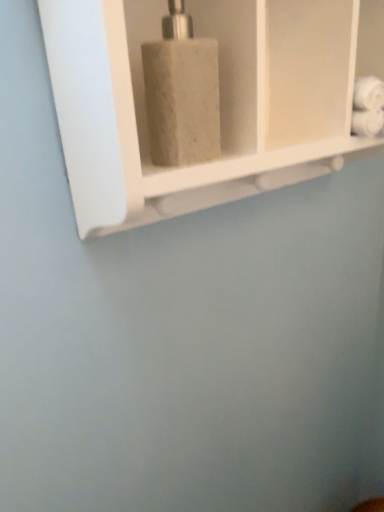
Where is `white marble soap dispenser at center`? Image resolution: width=384 pixels, height=512 pixels. white marble soap dispenser at center is located at coordinates (220, 102).

This screenshot has width=384, height=512. Describe the element at coordinates (220, 102) in the screenshot. I see `white marble soap dispenser at center` at that location.

From the picture: Measure the distance between white marble soap dispenser at center and camera.

The depth of white marble soap dispenser at center is 33.11 centimeters.

You are a GUI agent. You are given a task and a screenshot of the screen. Output one action in this format:
    pyautogui.click(x=<x>, y=<y>)
    Task: Click on the matte gray soap dispenser at center
    The width and height of the screenshot is (384, 512).
    Given the screenshot: What is the action you would take?
    pyautogui.click(x=182, y=93)

This screenshot has height=512, width=384. Describe the element at coordinates (182, 93) in the screenshot. I see `matte gray soap dispenser at center` at that location.

Where is `white marble soap dispenser at center`? The image size is (384, 512). white marble soap dispenser at center is located at coordinates (220, 102).

Consider the image. Which object is positioned more to the right, white marble soap dispenser at center or matte gray soap dispenser at center?

white marble soap dispenser at center.

Looking at this image, does white marble soap dispenser at center come in front of matte gray soap dispenser at center?

That is True.

Which point is more distant from viewer, [311,56] or [201,106]?

The point [311,56] is farther from the camera.

From the image's perspective, relative to matte gray soap dispenser at center, is white marble soap dispenser at center above or below?

white marble soap dispenser at center is situated higher than matte gray soap dispenser at center in the image.

From a real-world perspective, is white marble soap dispenser at center on matte gray soap dispenser at center?

No, from a real-world perspective, white marble soap dispenser at center is not on top of matte gray soap dispenser at center.

Looking at their sizes, would you say white marble soap dispenser at center is wider or thinner than matte gray soap dispenser at center?

white marble soap dispenser at center is wider than matte gray soap dispenser at center.

Who is shorter, white marble soap dispenser at center or matte gray soap dispenser at center?

matte gray soap dispenser at center is shorter.

Which of these two, white marble soap dispenser at center or matte gray soap dispenser at center, is smaller?

matte gray soap dispenser at center is smaller.

Is matte gray soap dispenser at center located within white marble soap dispenser at center?

Indeed, matte gray soap dispenser at center is located within white marble soap dispenser at center.

Is white marble soap dispenser at center directly adjacent to matte gray soap dispenser at center?

No, white marble soap dispenser at center is not with matte gray soap dispenser at center.

Could you tell me if white marble soap dispenser at center is facing matte gray soap dispenser at center?

Yes, white marble soap dispenser at center is aimed at matte gray soap dispenser at center.

How different are the orientations of white marble soap dispenser at center and matte gray soap dispenser at center in degrees?

white marble soap dispenser at center and matte gray soap dispenser at center are facing 0.273 degrees away from each other.

Locate an element on the screen. Image resolution: width=384 pixels, height=512 pixels. soap dispenser lying below the white marble soap dispenser at center (from the image's perspective) is located at coordinates tap(182, 93).

Which is more to the right, matte gray soap dispenser at center or white marble soap dispenser at center?

Positioned to the right is white marble soap dispenser at center.

Which object is closer to the camera taking this photo, matte gray soap dispenser at center or white marble soap dispenser at center?

white marble soap dispenser at center.

Considering the points (188, 125) and (161, 219), which point is behind, point (188, 125) or point (161, 219)?

Point (161, 219)

Looking at this image, from the image's perspective, is matte gray soap dispenser at center on white marble soap dispenser at center?

No, from the image's perspective, matte gray soap dispenser at center is not above white marble soap dispenser at center.

From a real-world perspective, relative to white marble soap dispenser at center, is matte gray soap dispenser at center vertically above or below?

From a real-world perspective, matte gray soap dispenser at center is physically above white marble soap dispenser at center.

Does matte gray soap dispenser at center have a lesser width compared to white marble soap dispenser at center?

Correct, the width of matte gray soap dispenser at center is less than that of white marble soap dispenser at center.

Is matte gray soap dispenser at center taller than white marble soap dispenser at center?

Incorrect, the height of matte gray soap dispenser at center is not larger of that of white marble soap dispenser at center.

Which of these two, matte gray soap dispenser at center or white marble soap dispenser at center, is smaller?

Smaller between the two is matte gray soap dispenser at center.

Could white marble soap dispenser at center be considered to be inside matte gray soap dispenser at center?

No, matte gray soap dispenser at center does not contain white marble soap dispenser at center.

Is matte gray soap dispenser at center with white marble soap dispenser at center?

No, matte gray soap dispenser at center is not making contact with white marble soap dispenser at center.

Is matte gray soap dispenser at center facing towards white marble soap dispenser at center?

Yes, matte gray soap dispenser at center is oriented towards white marble soap dispenser at center.

How different are the orientations of matte gray soap dispenser at center and white marble soap dispenser at center in degrees?

They differ by 0.273 degrees in their facing directions.

Locate an element on the screen. shelf located in front of the matte gray soap dispenser at center is located at coordinates (220, 102).

Locate an element on the screen. This screenshot has width=384, height=512. shelf in front of the matte gray soap dispenser at center is located at coordinates tap(220, 102).

Where is `soap dispenser behind the white marble soap dispenser at center`? The width and height of the screenshot is (384, 512). soap dispenser behind the white marble soap dispenser at center is located at coordinates [182, 93].